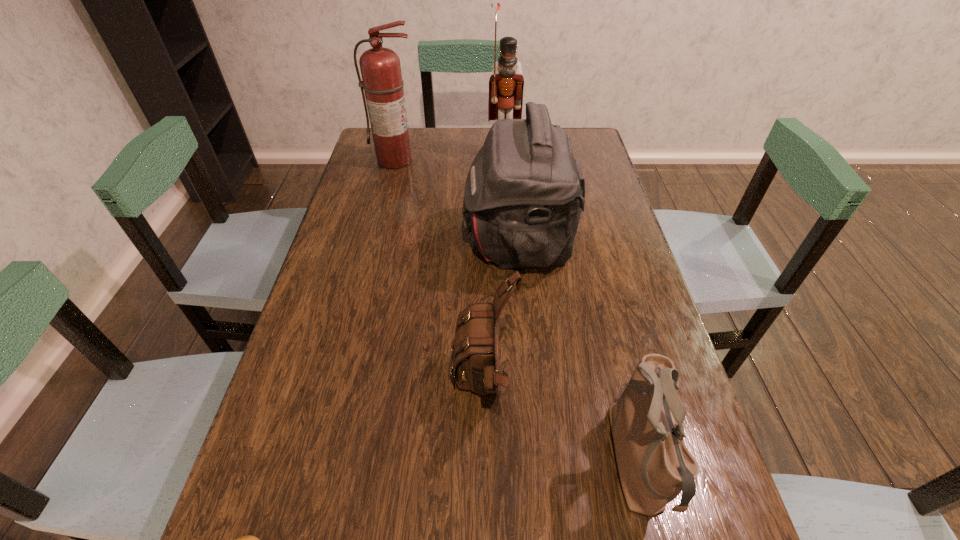
Identify the location of nutcracker. This screenshot has width=960, height=540. (506, 86).

Where is `fire extinguisher`? fire extinguisher is located at coordinates (382, 82).

I want to click on the farthest shoulder bag, so click(524, 192).

I want to click on the fourth shortest object, so click(524, 192).

I want to click on free location located on the front-facing side of the nutcracker, so click(507, 201).

Where is `free space located 0.310m on the front-facing side of the fire extinguisher`? The image size is (960, 540). free space located 0.310m on the front-facing side of the fire extinguisher is located at coordinates (378, 231).

Find the location of a particular element. Image resolution: width=960 pixels, height=540 pixels. vacant space located on the open flap of the fourth shortest object is located at coordinates (369, 241).

Identify the location of free spot located on the open flap of the fourth shortest object. Image resolution: width=960 pixels, height=540 pixels. (358, 241).

Where is `vacant space located 0.230m on the open flap of the fourth shortest object`? vacant space located 0.230m on the open flap of the fourth shortest object is located at coordinates (379, 241).

You are a GUI agent. You are given a task and a screenshot of the screen. Output one action in this format:
    pyautogui.click(x=<x>, y=<y>)
    Task: Click on the nutcracker at the far edge
    The width and height of the screenshot is (960, 540).
    Given the screenshot: What is the action you would take?
    pyautogui.click(x=506, y=86)